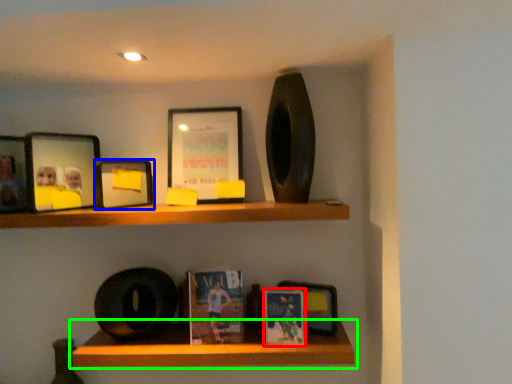
Question: Which object is the farthest from paperback book (highlighted by a red box)? Choose among these: picture frame (highlighted by a blue box) or shelf (highlighted by a green box).

Choices:
 (A) picture frame
 (B) shelf

Answer: (A)